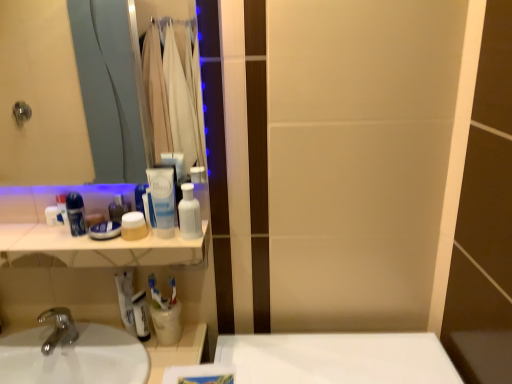
Find the location of a particular element. This screenshot has width=512, height=384. free space to the left of silver metallic faucet at lower left is located at coordinates click(x=23, y=342).